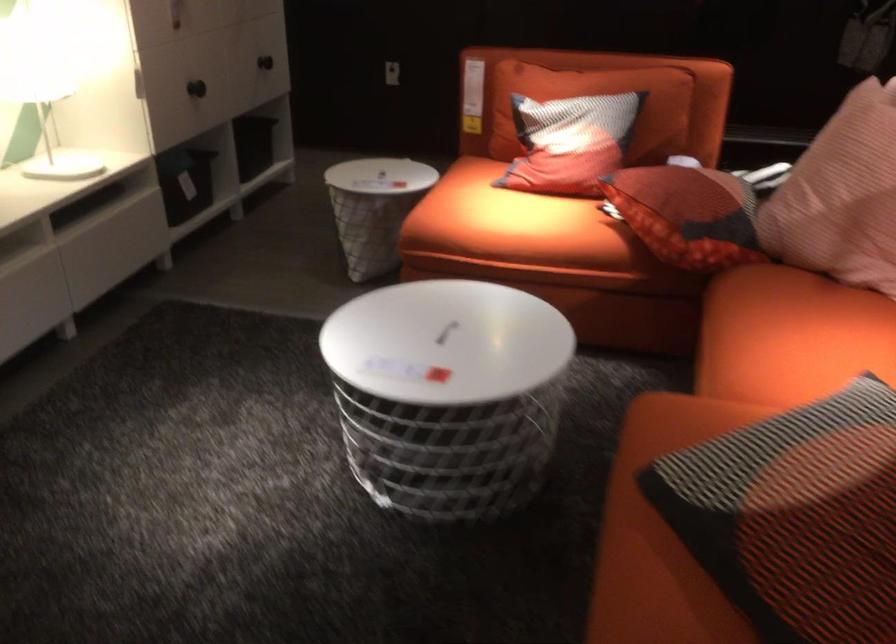
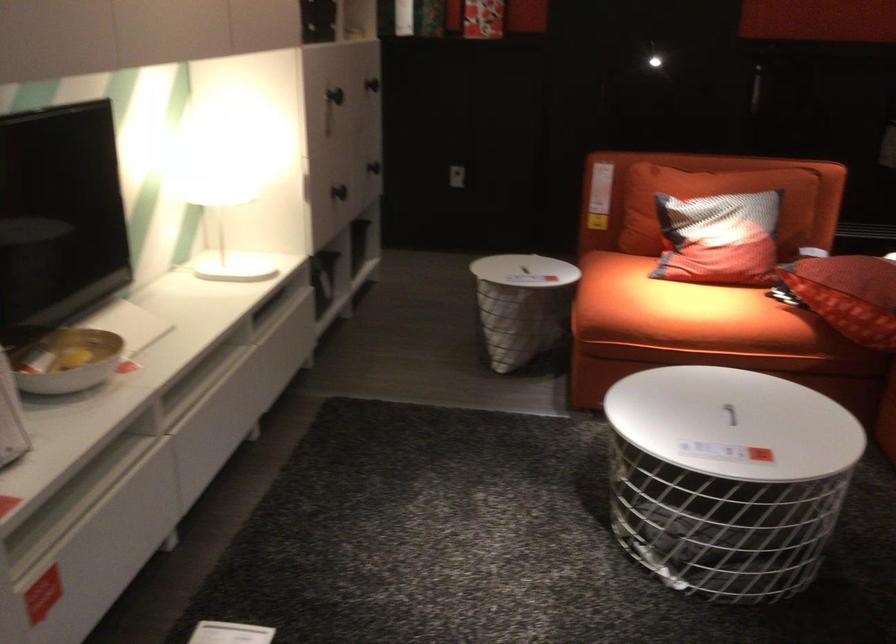
Where in the second image is the point corresponding to (555,147) from the first image?

(719, 239)